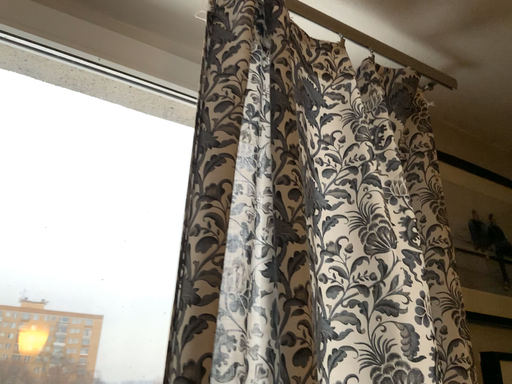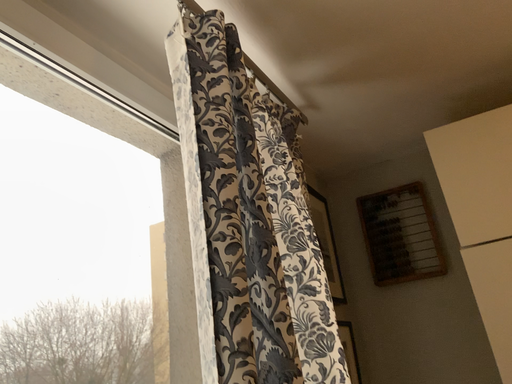
Question: Which way did the camera rotate in the video?

Choices:
 (A) rotated right
 (B) rotated left

Answer: (A)